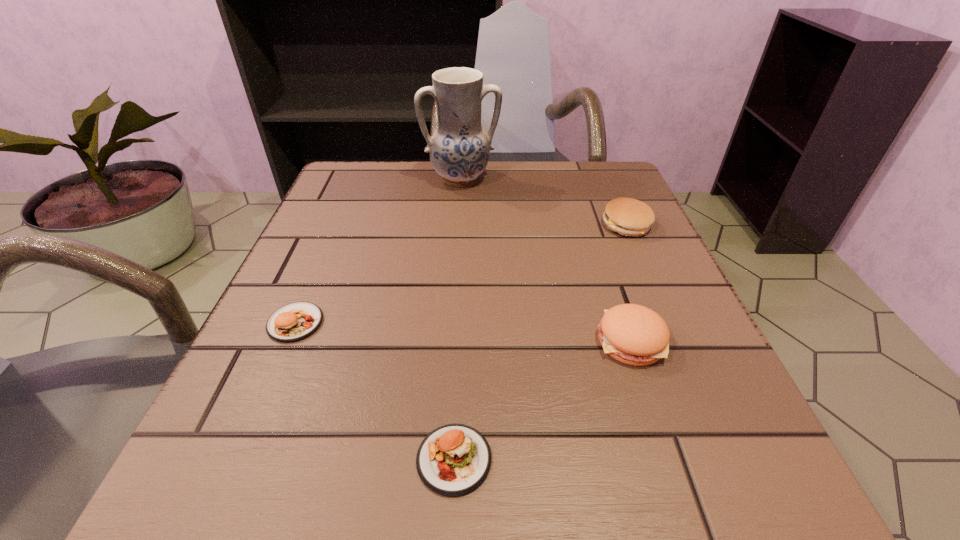
This screenshot has height=540, width=960. I want to click on object that is the second closest to the farthest object, so click(296, 321).

Locate an element on the screen. The image size is (960, 540). patty (food) that stands as the third closest to the leftmost patty (food) is located at coordinates (627, 216).

Locate which patty (food) ranks second in proximity to the fourth nearest object. Please provide its 2D coordinates. Your answer should be formatted as a tuple, i.e. [(x, y)], where the tuple contains the x and y coordinates of a point satisfying the conditions above.

[(453, 460)]

Locate an element on the screen. This screenshot has height=540, width=960. free space that satisfies the following two spatial constraints: 1. on the back side of the fourth nearest object; 2. on the left side of the leftmost patty (food) is located at coordinates (337, 225).

Find the location of `free location that satisfies the following two spatial constraints: 1. on the back side of the fourth nearest object; 2. on the left side of the second patty (food) from left to right`. free location that satisfies the following two spatial constraints: 1. on the back side of the fourth nearest object; 2. on the left side of the second patty (food) from left to right is located at coordinates (465, 225).

What are the coordinates of `free region that satisfies the following two spatial constraints: 1. on the front side of the shortest object; 2. on the right side of the leftmost object` in the screenshot? It's located at (237, 459).